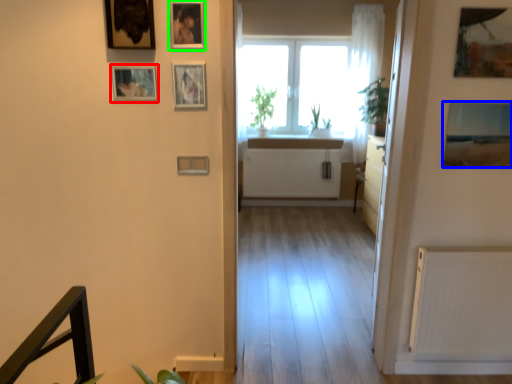
Question: Considering the real-world distances, which object is closest to picture frame (highlighted by a red box)? picture frame (highlighted by a blue box) or picture frame (highlighted by a green box).

Choices:
 (A) picture frame
 (B) picture frame

Answer: (B)